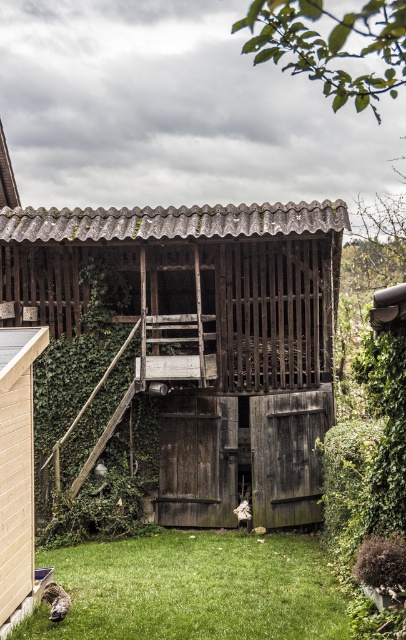
Question: Can you confirm if weathered wood hut at center is bigger than green grass at lower left?

Choices:
 (A) yes
 (B) no

Answer: (A)

Question: Is green grass at lower left to the right of beige wood shed at lower left from the viewer's perspective?

Choices:
 (A) no
 (B) yes

Answer: (B)

Question: Which is farther from the green grass at lower left?

Choices:
 (A) beige wood shed at lower left
 (B) weathered wood hut at center

Answer: (B)

Question: Estimate the real-world distances between objects in this image. Which object is closer to the weathered wood hut at center?

Choices:
 (A) beige wood shed at lower left
 (B) green grass at lower left

Answer: (A)

Question: Does green grass at lower left have a smaller size compared to beige wood shed at lower left?

Choices:
 (A) yes
 (B) no

Answer: (A)

Question: Among these points, which one is nearest to the camera?

Choices:
 (A) (x=110, y=634)
 (B) (x=203, y=449)

Answer: (A)